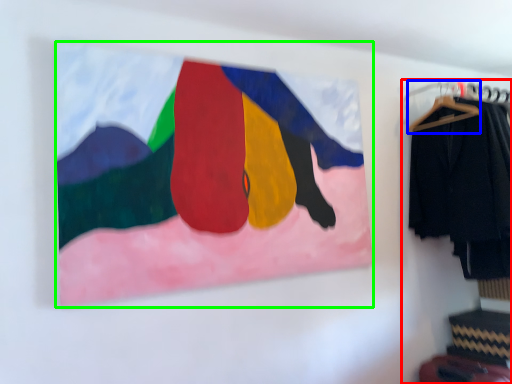
Question: Considering the real-world distances, which object is closest to closet (highlighted by a red box)? hanger (highlighted by a blue box) or picture frame (highlighted by a green box).

Choices:
 (A) hanger
 (B) picture frame

Answer: (A)